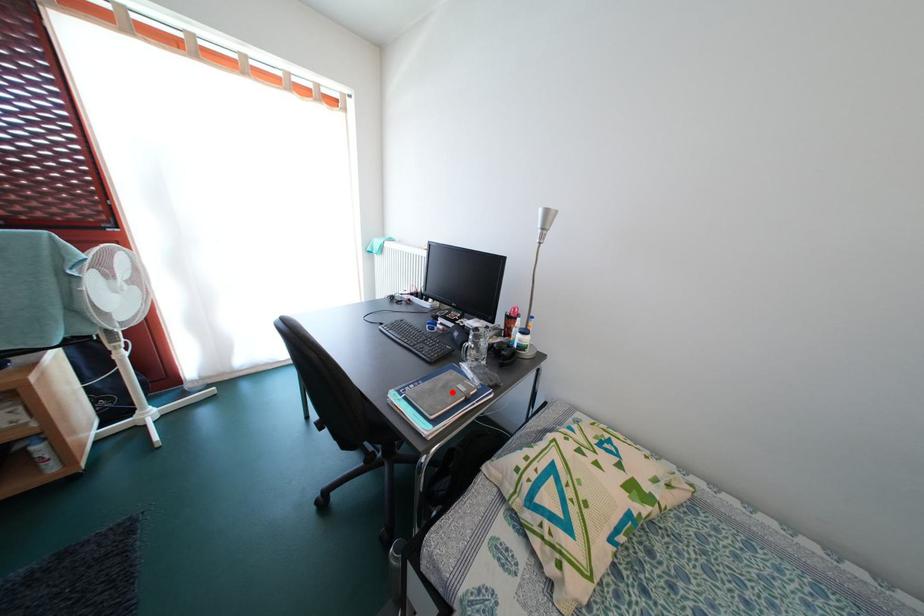
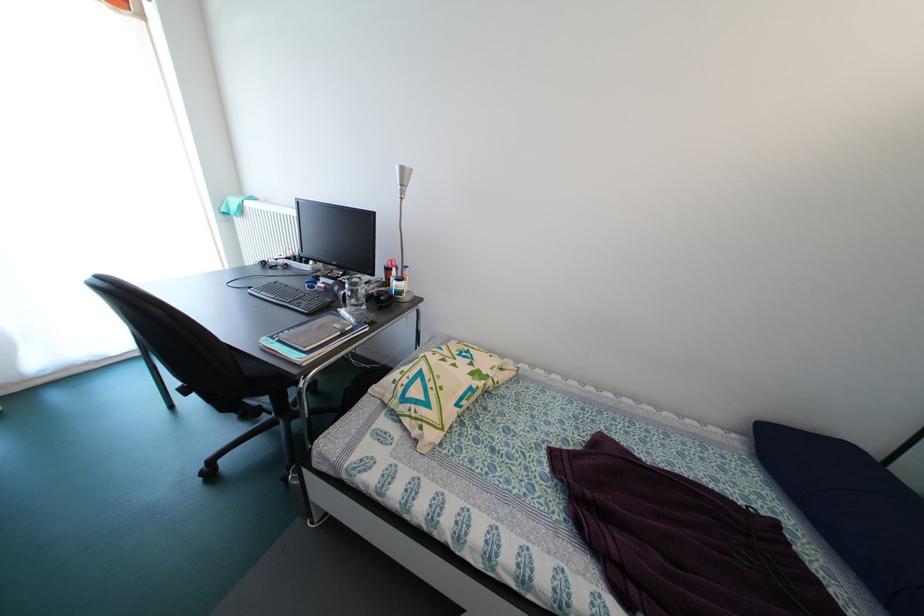
Where in the second image is the point corresponding to the highlighted location from the first image?

(327, 331)